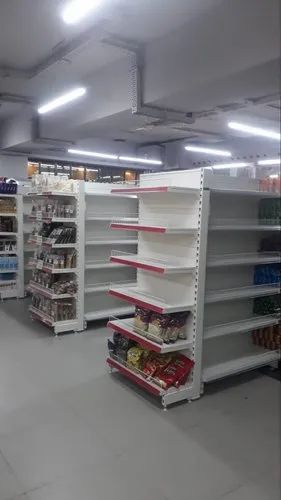
Locate an element on the screen. This screenshot has height=500, width=281. lighting fixtures is located at coordinates (253, 129), (200, 149), (94, 153), (58, 103), (228, 165), (268, 161), (135, 159).